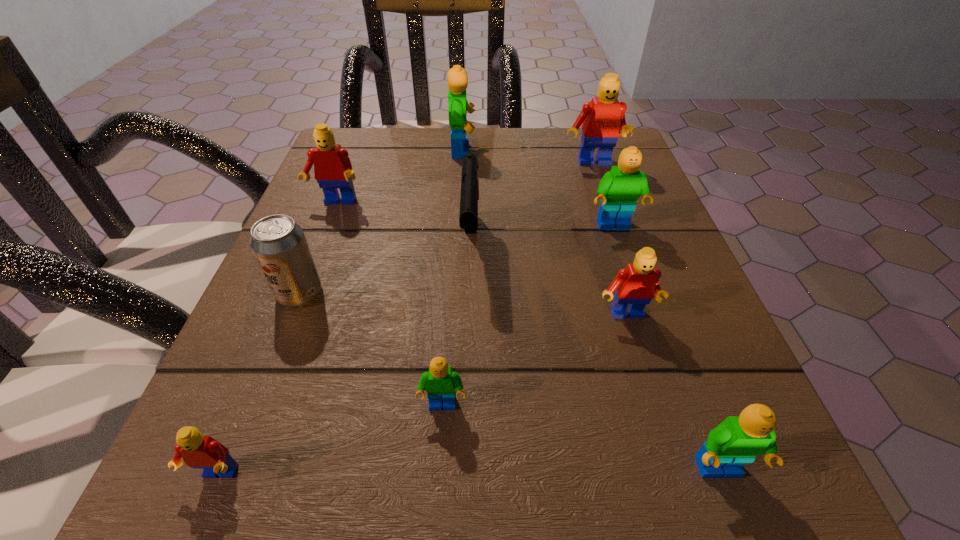
Locate an element on the screen. The height and width of the screenshot is (540, 960). the biggest green Lego is located at coordinates (458, 106).

Image resolution: width=960 pixels, height=540 pixels. Identify the location of the farthest red Lego. (601, 119).

At what (x,y) coordinates should I click in order to perform the action: click on the eighth nearest object. Please return your answer as a coordinate pair (x, y). The height and width of the screenshot is (540, 960). Looking at the image, I should click on (332, 167).

Image resolution: width=960 pixels, height=540 pixels. I want to click on the second farthest red Lego, so click(x=332, y=167).

In order to click on the third smallest green Lego in this screenshot , I will do `click(619, 189)`.

Identify the location of the fifth nearest Lego. pyautogui.click(x=619, y=189).

Find the location of `black pistol`. black pistol is located at coordinates (468, 217).

Identify the location of beer can. (x=279, y=244).

Find the location of a particular element. The width and height of the screenshot is (960, 540). the second smallest red Lego is located at coordinates (636, 285).

What are the coordinates of `the third farthest red Lego` in the screenshot? It's located at (636, 285).